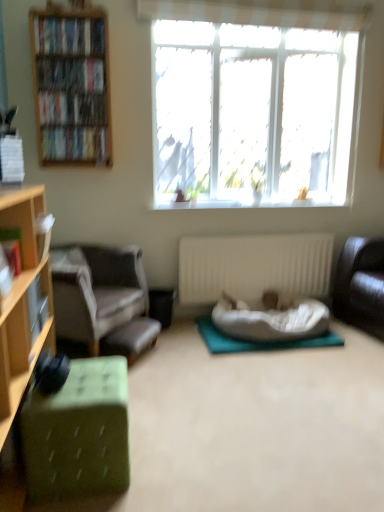
Identify the location of unoccupied region to the right of gray fabric chair at left. (189, 354).